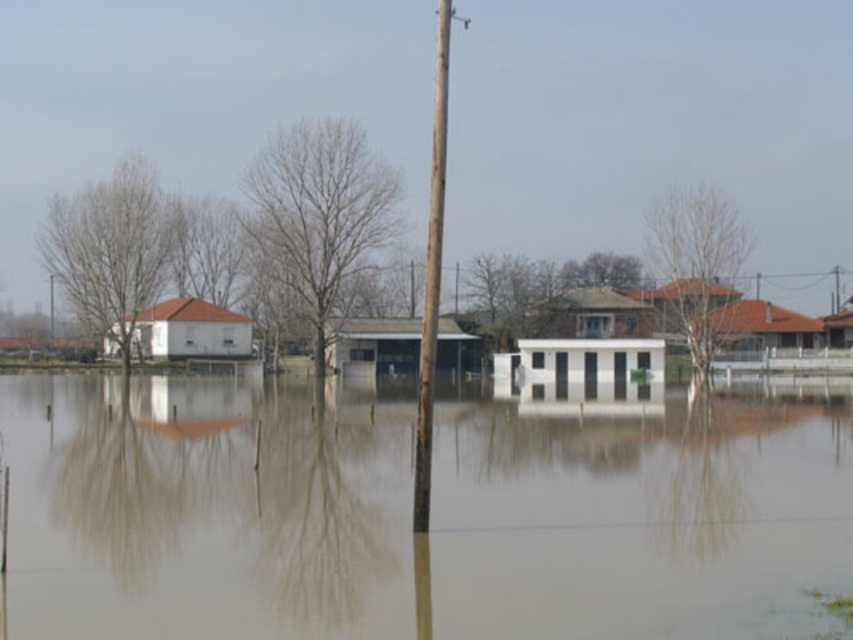
Can you confirm if bare wood tree at left is positioned above bare branches at center?

No.

Looking at this image, does bare wood tree at left appear on the right side of bare branches at center?

In fact, bare wood tree at left is to the left of bare branches at center.

The width and height of the screenshot is (853, 640). Describe the element at coordinates (109, 250) in the screenshot. I see `bare wood tree at left` at that location.

The width and height of the screenshot is (853, 640). Identify the location of bare wood tree at left. (109, 250).

Does brown leafless tree at center lie behind bare branches at center?

Yes, brown leafless tree at center is behind bare branches at center.

Can you confirm if brown leafless tree at center is thinner than bare branches at center?

Incorrect, brown leafless tree at center's width is not less than bare branches at center's.

Where is `brown leafless tree at center`? The height and width of the screenshot is (640, 853). brown leafless tree at center is located at coordinates pos(552,298).

Find the location of a particular element. The image size is (853, 640). brown leafless tree at center is located at coordinates (552, 298).

Which is more to the left, brown murky water at center or brown leafless tree at center?

From the viewer's perspective, brown murky water at center appears more on the left side.

Is brown murky water at center above brown leafless tree at center?

No, brown murky water at center is not above brown leafless tree at center.

Does point (726, 630) lie behind point (585, 296)?

No, it is not.

Where is `brown murky water at center`? The width and height of the screenshot is (853, 640). brown murky water at center is located at coordinates (410, 515).